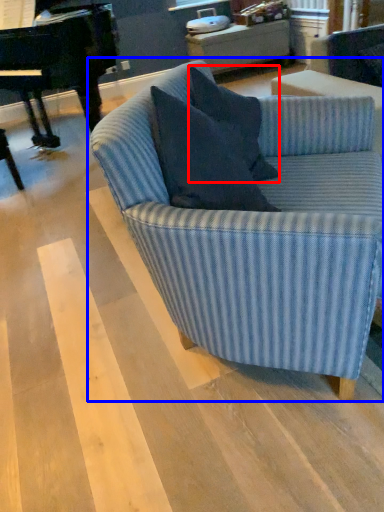
Question: Which of the following is the closest to the observer, pillow (highlighted by a red box) or studio couch (highlighted by a blue box)?

Choices:
 (A) pillow
 (B) studio couch

Answer: (B)